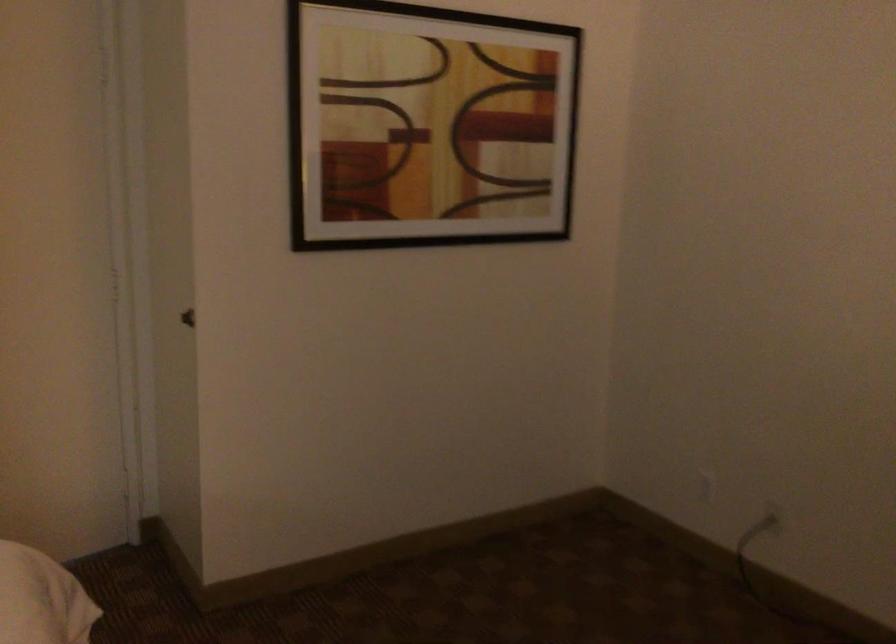
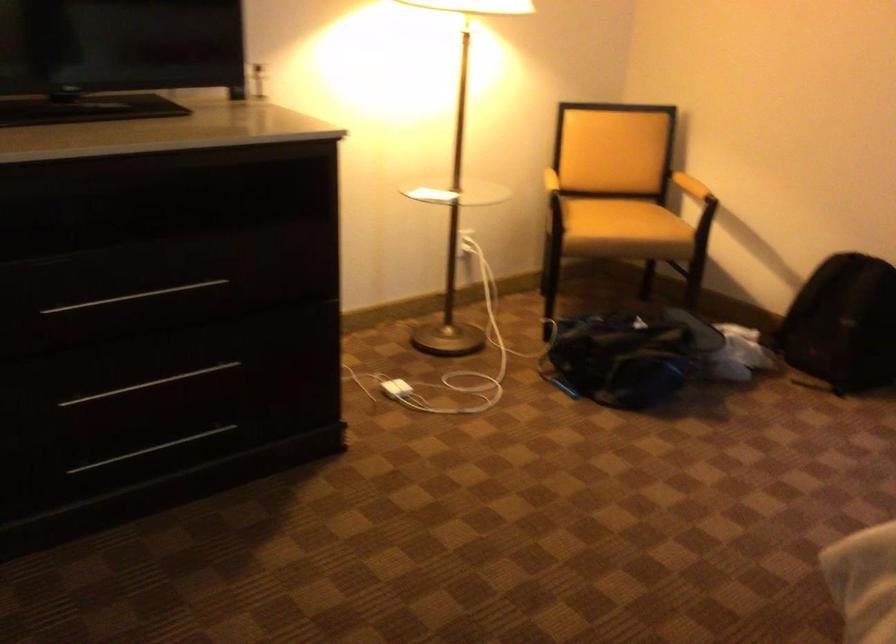
Based on the continuous images, in which direction is the camera rotating?

The camera's rotation is toward right-down.